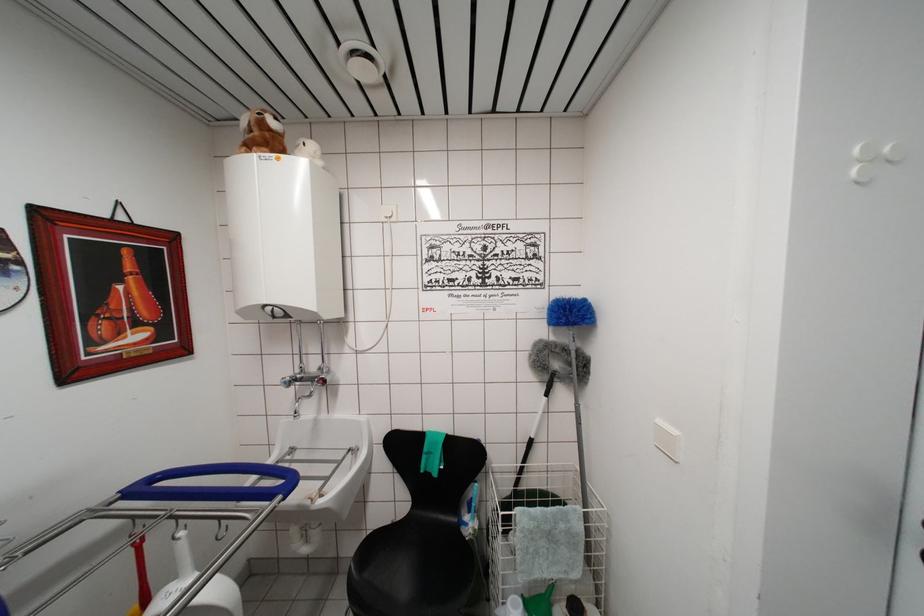
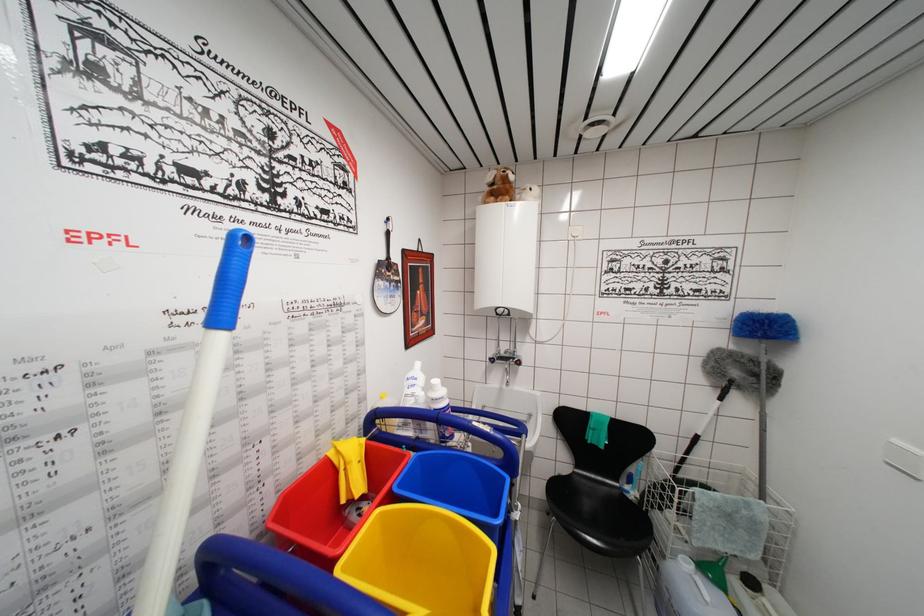
Question: The first image is from the beginning of the video and the second image is from the end. How did the camera likely rotate when shooting the video?

Choices:
 (A) Left
 (B) Right
 (C) Up
 (D) Down

Answer: (A)